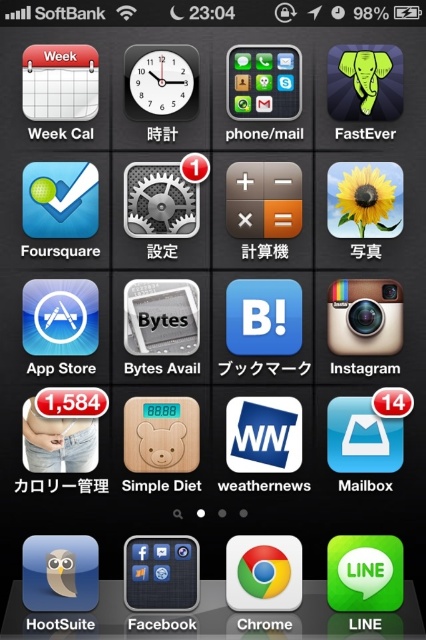
Question: Is green matte line at bottom right closer to the viewer compared to matte black smartphone at center?

Choices:
 (A) yes
 (B) no

Answer: (A)

Question: Does chromeshiny/reflectivebrowser at center appear on the left side of matte black smartphone at center?

Choices:
 (A) no
 (B) yes

Answer: (A)

Question: From the image, what is the correct spatial relationship of matte black smartphone at center in relation to matte black grid at center?

Choices:
 (A) right
 (B) left

Answer: (B)

Question: Which object appears farthest from the camera in this image?

Choices:
 (A) green matte line at bottom right
 (B) matte black grid at center
 (C) chromeshiny/reflectivebrowser at center

Answer: (B)

Question: Estimate the real-world distances between objects in this image. Which object is farther from the matte black smartphone at center?

Choices:
 (A) chromeshiny/reflectivebrowser at center
 (B) green matte line at bottom right
 (C) matte black grid at center

Answer: (C)

Question: Estimate the real-world distances between objects in this image. Which object is farther from the matte black grid at center?

Choices:
 (A) green matte line at bottom right
 (B) matte black smartphone at center

Answer: (B)